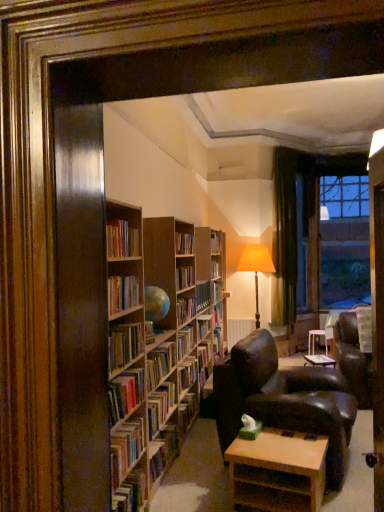
Question: Is point (284, 501) positioned closer to the camera than point (296, 254)?

Choices:
 (A) closer
 (B) farther

Answer: (A)

Question: Considering the positions of light brown wooden table at lower center and clear glass window at upper right in the image, is light brown wooden table at lower center taller or shorter than clear glass window at upper right?

Choices:
 (A) short
 (B) tall

Answer: (A)

Question: Which is nearer to the hardcover book at lower left, which is the fifth book from top to bottom?

Choices:
 (A) leather armchair at center
 (B) transparent glass door at upper right
 (C) hardcover books at center, the third book positioned from the bottom
 (D) wooden bookshelf at center, the 2th book viewed from the top
 (E) wooden bookcase at left

Answer: (C)

Question: Estimate the real-world distances between objects in this image. Which object is closer to the green velvet curtain at right?

Choices:
 (A) hardcover books at left, which ranks as the fifth book in bottom-to-top order
 (B) leather armchair at center
 (C) hardcover books at center, the third book positioned from the bottom
 (D) wooden bookcase at left
 (E) hardcover book at lower left, placed as the 1th book when sorted from bottom to top

Answer: (B)